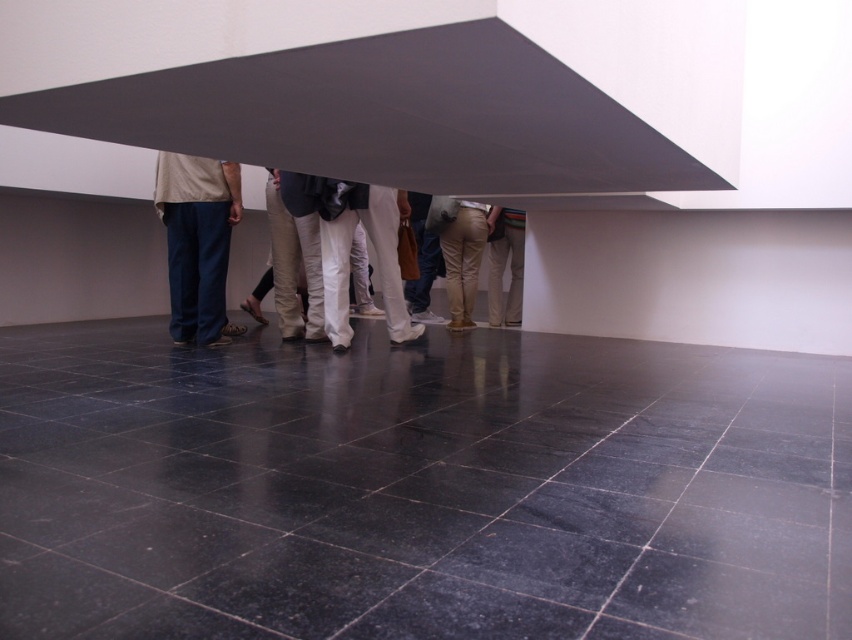
You are an interior designer assessing the space. You notice two pairs of khaki pants at center and khaki cotton pants at center. Which pair is longer?

The khaki pants at center is taller than khaki cotton pants at center.

You are standing at the entrance of the room and see the point at coordinates (196, 241). What is the object located at that point?

The denim pants at center is located at point (196, 241).

You are a photographer trying to capture a group photo of the denim pants at center and khaki cotton pants at center. Your camera has a maximum focus range of 2 meters. Will you be able to capture both subjects in focus without moving the camera?

The denim pants at center and khaki cotton pants at center are 2.16 meters apart. Since the camera can only focus up to 2 meters, the distance between them exceeds the focus range. Therefore, you cannot capture both in focus without adjusting the camera position or settings.